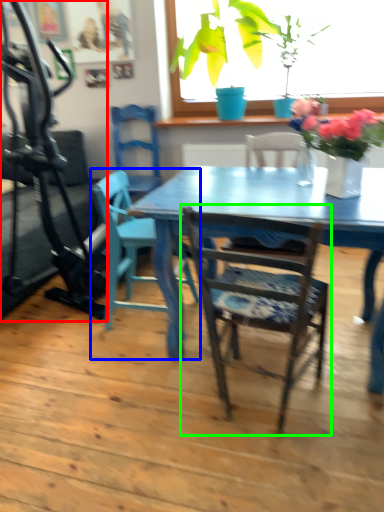
Question: Estimate the real-world distances between objects in this image. Which object is closer to treadmill (highlighted by a red box), chair (highlighted by a blue box) or chair (highlighted by a green box)?

Choices:
 (A) chair
 (B) chair

Answer: (A)